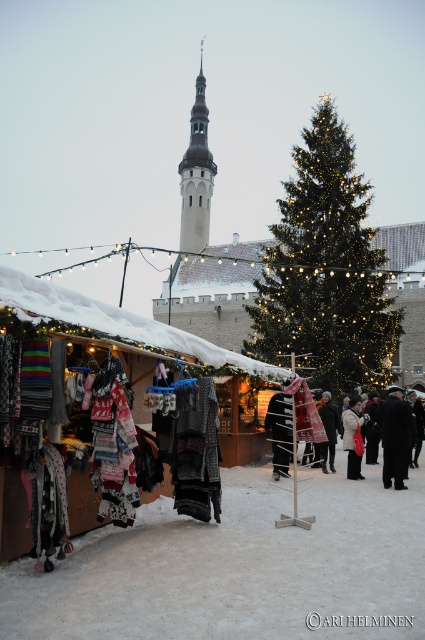
You are a customer at the winter market and want to try on both the black wool coat at center and the black woolen sweater at center. If you have a bag that can only carry one item, which item should you choose to take first based on their sizes?

The black wool coat at center is wider than the black woolen sweater at center. Therefore, you should take the black wool coat at center first to ensure it fits in your bag before placing the smaller sweater.

You are a customer at the winter market and want to buy a coat. You see the black wool coat at center and the illuminated green pine at center. Which item is larger in size?

Answer: The illuminated green pine at center is bigger than the black wool coat at center.

You are a customer at the winter market and want to see both the black wool coat at center and the black woolen sweater at center. Which one is closer to you?

A: The black wool coat at center is closer to you since the black woolen sweater at center is positioned behind it.